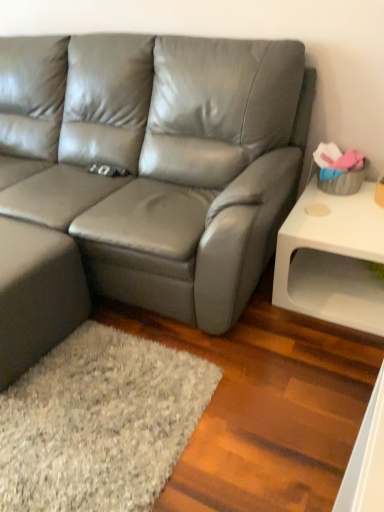
I want to click on vacant space in front of white matte side table at right, so click(317, 361).